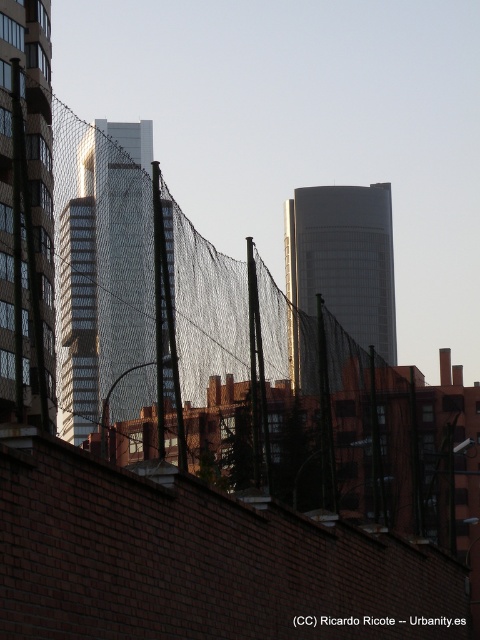
Question: Among these objects, which one is farthest from the camera?

Choices:
 (A) smooth glass skyscraper at center
 (B) smooth glass tower at center

Answer: (B)

Question: Can you confirm if matte glass skyscraper at left is positioned to the right of smooth glass tower at center?

Choices:
 (A) no
 (B) yes

Answer: (A)

Question: Which point appears farthest from the camera in this image?

Choices:
 (A) (40, 54)
 (B) (344, 204)

Answer: (B)

Question: Does matte glass skyscraper at left appear over smooth glass skyscraper at center?

Choices:
 (A) no
 (B) yes

Answer: (A)

Question: Among these points, which one is nearest to the camera?

Choices:
 (A) (37, 157)
 (B) (144, 328)
 (C) (384, 237)

Answer: (A)

Question: Is matte glass skyscraper at left wider than smooth glass tower at center?

Choices:
 (A) no
 (B) yes

Answer: (A)